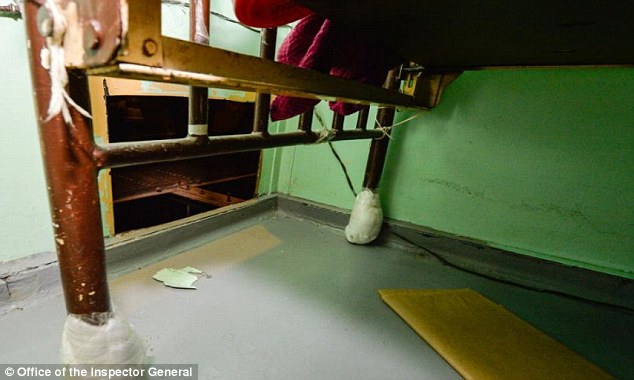
You are a GUI agent. You are given a task and a screenshot of the screen. Output one action in this format:
    pyautogui.click(x=<x>, y=<y>)
    Task: Click on the floor
    This screenshot has height=380, width=634.
    Given the screenshot: What is the action you would take?
    pyautogui.click(x=293, y=327)